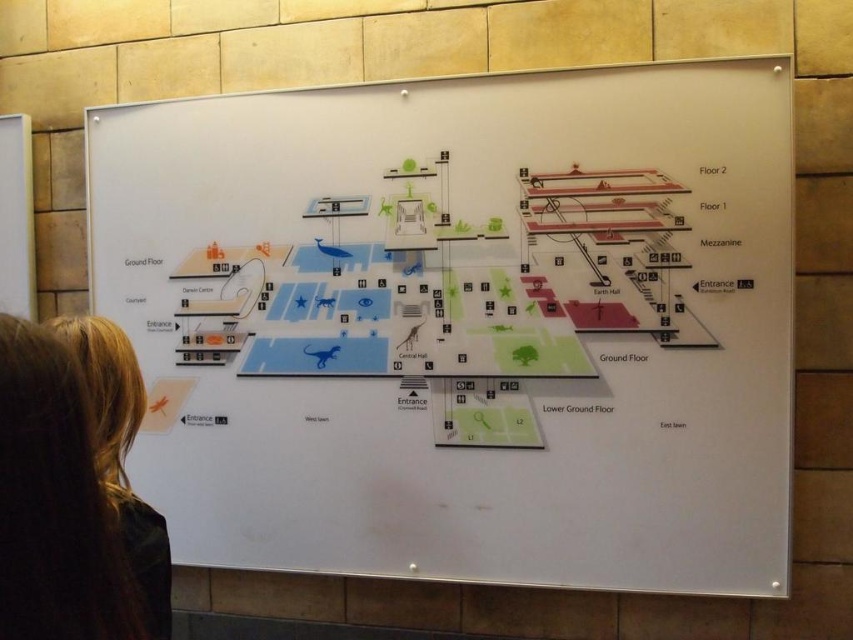
Is white paper map at upper center positioned before blonde hair at lower left?

No, white paper map at upper center is behind blonde hair at lower left.

Is white paper map at upper center to the right of blonde hair at lower left from the viewer's perspective?

Indeed, white paper map at upper center is positioned on the right side of blonde hair at lower left.

Does point (410, 394) lie behind point (53, 330)?

Yes.

What are the coordinates of `white paper map at upper center` in the screenshot? It's located at (463, 323).